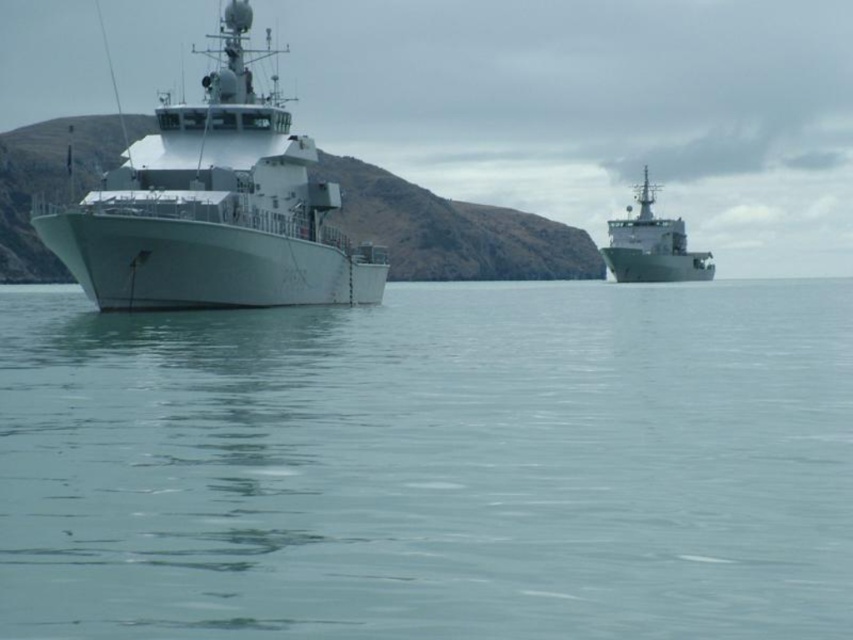
Which is above, clear blue water at center or metallic gray ship at upper right?

metallic gray ship at upper right

Describe the element at coordinates (431, 465) in the screenshot. The width and height of the screenshot is (853, 640). I see `clear blue water at center` at that location.

The height and width of the screenshot is (640, 853). I want to click on clear blue water at center, so click(431, 465).

Which is behind, point (258, 116) or point (645, 227)?

The point (645, 227) is behind.

Which is more to the left, white matte ship at left or metallic gray ship at upper right?

Positioned to the left is white matte ship at left.

Does point (262, 124) come closer to viewer compared to point (637, 218)?

Yes, point (262, 124) is in front of point (637, 218).

This screenshot has height=640, width=853. What are the coordinates of `white matte ship at left` in the screenshot? It's located at (213, 208).

Who is shorter, clear blue water at center or white matte ship at left?

With less height is clear blue water at center.

Between point (225, 554) and point (292, 259), which one is positioned in front?

Point (225, 554) is more forward.

This screenshot has width=853, height=640. What are the coordinates of `clear blue water at center` in the screenshot? It's located at (431, 465).